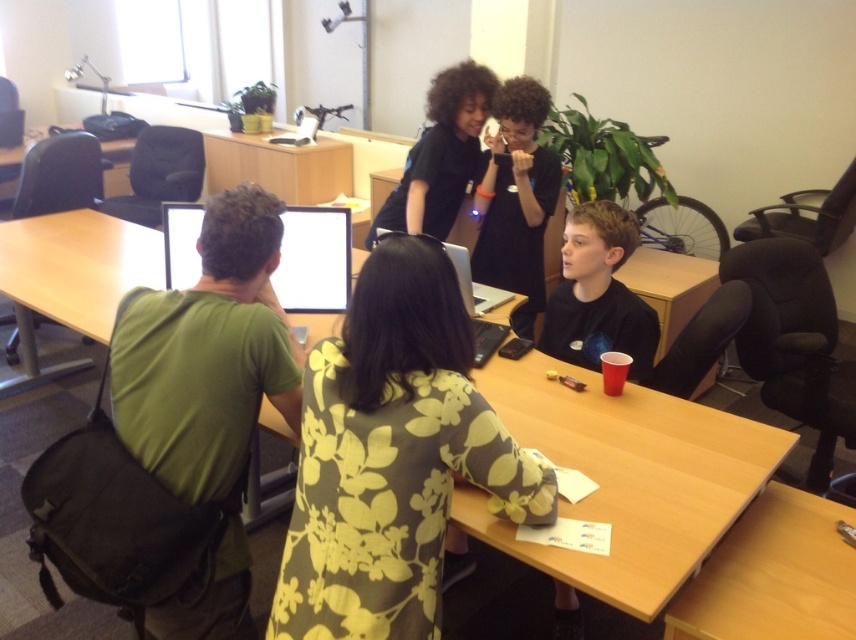
Question: Is floral-patterned shirt at center to the right of light brown wood table at lower right from the viewer's perspective?

Choices:
 (A) no
 (B) yes

Answer: (A)

Question: In this image, where is light brown wood table at lower right located relative to bright white glossy monitor at upper center?

Choices:
 (A) left
 (B) right

Answer: (B)

Question: Considering the real-world distances, which object is closest to the black matte shirt at upper center?

Choices:
 (A) light brown wood table at lower right
 (B) matte black laptop at center
 (C) white glossy monitor at upper center
 (D) black matte shirt at center

Answer: (C)

Question: Which object appears farthest from the camera in this image?

Choices:
 (A) black matte shirt at upper center
 (B) light brown wood table at lower right
 (C) wooden table at center
 (D) silver metallic laptop at center

Answer: (A)

Question: Among these objects, which one is farthest from the camera?

Choices:
 (A) black matte shirt at center
 (B) bright white glossy monitor at upper center

Answer: (A)

Question: Is wooden table at center positioned in front of black matte shirt at upper center?

Choices:
 (A) yes
 (B) no

Answer: (A)